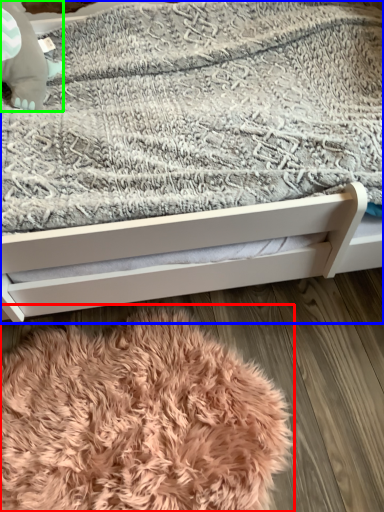
Question: Which object is the closest to the blanket (highlighted by a red box)? Choose among these: bed (highlighted by a blue box) or baby elephant (highlighted by a green box).

Choices:
 (A) bed
 (B) baby elephant

Answer: (A)